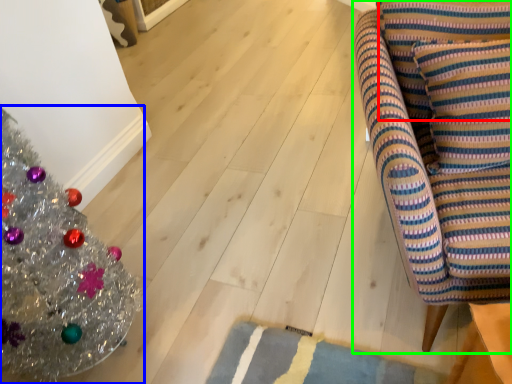
Question: Estimate the real-world distances between objects in this image. Which object is closer to pillow (highlighted by a red box), christmas tree (highlighted by a blue box) or furniture (highlighted by a green box)?

Choices:
 (A) christmas tree
 (B) furniture

Answer: (B)